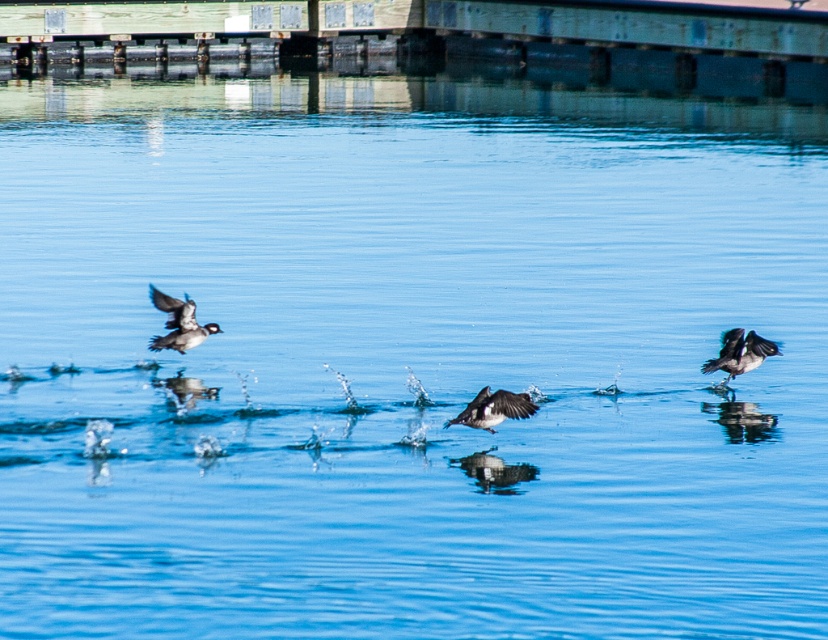
Does green painted wood at upper center have a greater height compared to dark brown feathers at right?

Yes, green painted wood at upper center is taller than dark brown feathers at right.

Is green painted wood at upper center below dark brown feathers at right?

Actually, green painted wood at upper center is above dark brown feathers at right.

Which is behind, point (306, 65) or point (764, 348)?

Point (306, 65)

Locate an element on the screen. This screenshot has height=640, width=828. green painted wood at upper center is located at coordinates (436, 40).

Does green painted wood at upper center appear over speckled feathered duck at center?

Yes.

Between green painted wood at upper center and speckled feathered duck at center, which one appears on the left side from the viewer's perspective?

speckled feathered duck at center is more to the left.

Find the location of a particular element. The height and width of the screenshot is (640, 828). green painted wood at upper center is located at coordinates (436, 40).

Image resolution: width=828 pixels, height=640 pixels. In order to click on green painted wood at upper center in this screenshot , I will do `click(436, 40)`.

Between speckled feathered duck at center and dark brown feathers at right, which one has more height?

Standing taller between the two is dark brown feathers at right.

Which is below, speckled feathered duck at center or dark brown feathers at right?

speckled feathered duck at center is lower down.

Who is more distant from viewer, (514, 416) or (724, 346)?

The point (724, 346) is behind.

Locate an element on the screen. The image size is (828, 640). speckled feathered duck at center is located at coordinates (493, 408).